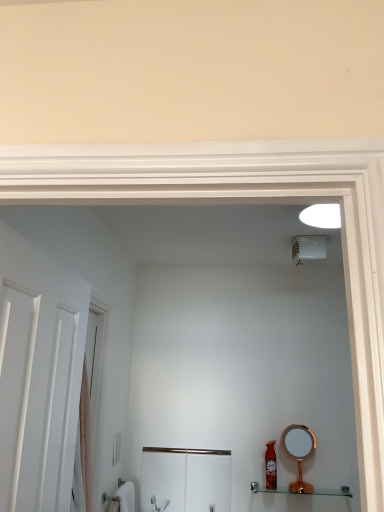
Question: From a real-world perspective, does shiny red bottle at lower right sit lower than white plastic light switch at lower left?

Choices:
 (A) no
 (B) yes

Answer: (B)

Question: From a real-world perspective, is shiny red bottle at lower right over white plastic light switch at lower left?

Choices:
 (A) yes
 (B) no

Answer: (B)

Question: Is shiny red bottle at lower right outside of white plastic light switch at lower left?

Choices:
 (A) yes
 (B) no

Answer: (A)

Question: Is shiny red bottle at lower right facing towards white plastic light switch at lower left?

Choices:
 (A) yes
 (B) no

Answer: (B)

Question: Can you confirm if shiny red bottle at lower right is wider than white plastic light switch at lower left?

Choices:
 (A) no
 (B) yes

Answer: (B)

Question: From the image's perspective, is copper metallic mirror at lower right located above or below white plastic light switch at lower left?

Choices:
 (A) below
 (B) above

Answer: (A)

Question: Considering the positions of point (309, 488) and point (112, 454), is point (309, 488) closer or farther from the camera than point (112, 454)?

Choices:
 (A) closer
 (B) farther

Answer: (B)

Question: From a real-world perspective, is copper metallic mirror at lower right positioned above or below white plastic light switch at lower left?

Choices:
 (A) above
 (B) below

Answer: (B)

Question: Is copper metallic mirror at lower right spatially inside white plastic light switch at lower left, or outside of it?

Choices:
 (A) inside
 (B) outside

Answer: (B)

Question: In terms of size, does copper metallic mirror at lower right appear bigger or smaller than shiny red bottle at lower right?

Choices:
 (A) big
 (B) small

Answer: (A)

Question: Relative to shiny red bottle at lower right, is copper metallic mirror at lower right in front or behind?

Choices:
 (A) front
 (B) behind

Answer: (A)

Question: Is point (311, 437) closer or farther from the camera than point (274, 459)?

Choices:
 (A) farther
 (B) closer

Answer: (A)

Question: From a real-world perspective, is copper metallic mirror at lower right physically located above or below shiny red bottle at lower right?

Choices:
 (A) below
 (B) above

Answer: (B)

Question: From the image's perspective, is pink fabric screen door at left, positioned as the 2th screen door in bottom-to-top order, positioned above or below brushed metal cabinet at lower center, placed as the 2th screen door when sorted from front to back?

Choices:
 (A) above
 (B) below

Answer: (A)

Question: In terms of size, does pink fabric screen door at left, placed as the first screen door when sorted from front to back, appear bigger or smaller than brushed metal cabinet at lower center, which is counted as the first screen door, starting from the back?

Choices:
 (A) small
 (B) big

Answer: (A)